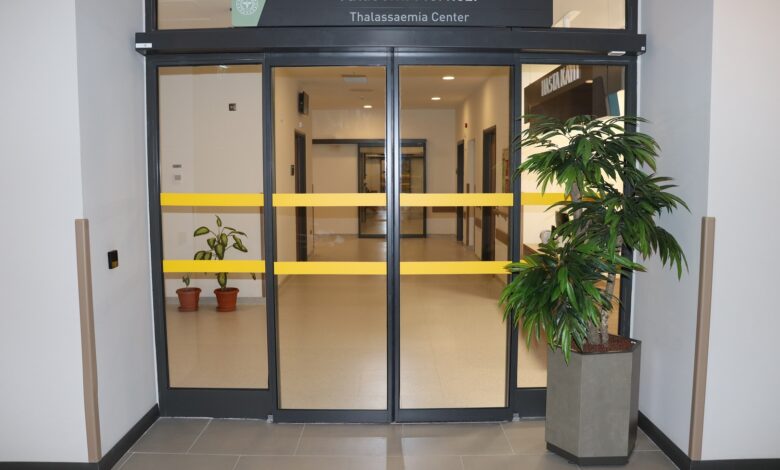
You are a GUI agent. You are given a task and a screenshot of the screen. Output one action in this format:
    pyautogui.click(x=<x>, y=<y>)
    Task: Click on the right-most plant limb
    
    Given the screenshot: What is the action you would take?
    pyautogui.click(x=605, y=298)